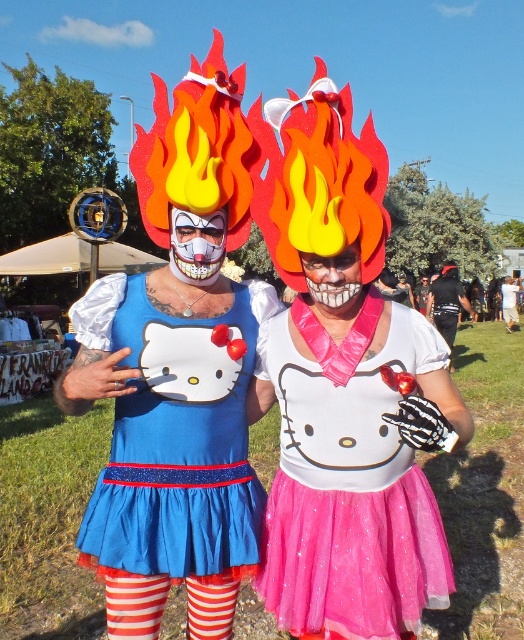
You are a photographer trying to capture a clear shot of the matte clown mask at center without the black leather jacket at center blocking it. Based on the scene, is this possible?

The matte clown mask at center is in front of the black leather jacket at center, so it is possible to capture a clear shot of the matte clown mask at center without the black leather jacket at center blocking it.

You are a costume designer assessing the two headpieces in the image. Which headpiece, the matte clown mask at center or the shiny black helmet at center, is shorter in height?

The matte clown mask at center has a lesser height compared to the shiny black helmet at center, so the matte clown mask at center is shorter in height.

You are a photographer trying to capture a photo of the two individuals in the scene. You notice the black leather jacket at center and the shiny black helmet at center. Which object should you focus on first if you want to ensure both are in the frame without moving the camera?

The black leather jacket at center is located below the shiny black helmet at center. Since the jacket is below the helmet, you should focus on the shiny black helmet at center first to ensure it stays in the frame when adjusting the camera angle.